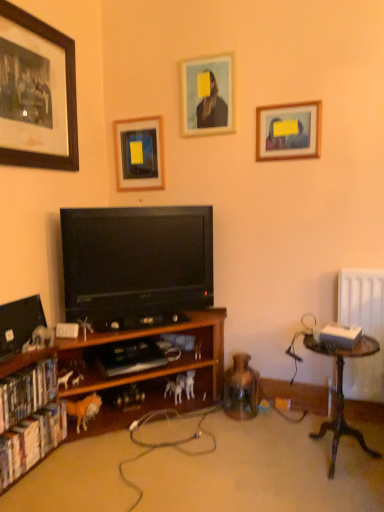
You are a GUI agent. You are given a task and a screenshot of the screen. Output one action in this format:
    pyautogui.click(x=<x>, y=<y>)
    Task: Click on the spots to the right of orange plush horse at lower left, placed as the second animal when sorted from right to left
    
    Given the screenshot: What is the action you would take?
    pyautogui.click(x=109, y=438)